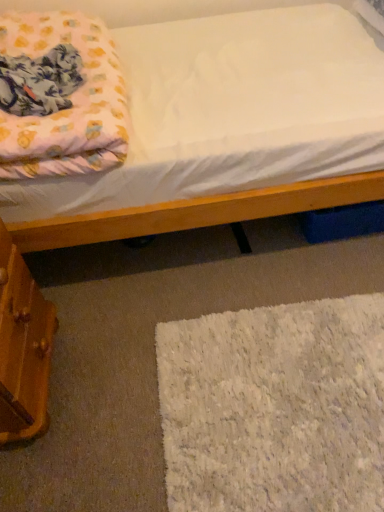
Question: Is wooden drawer at lower left not near fluffy pink blanket at upper left?

Choices:
 (A) yes
 (B) no

Answer: (B)

Question: Is wooden drawer at lower left placed right next to fluffy pink blanket at upper left?

Choices:
 (A) no
 (B) yes

Answer: (A)

Question: Considering the relative sizes of wooden drawer at lower left and fluffy pink blanket at upper left in the image provided, is wooden drawer at lower left thinner than fluffy pink blanket at upper left?

Choices:
 (A) yes
 (B) no

Answer: (A)

Question: Is wooden drawer at lower left shorter than fluffy pink blanket at upper left?

Choices:
 (A) no
 (B) yes

Answer: (A)

Question: From a real-world perspective, is wooden drawer at lower left positioned over fluffy pink blanket at upper left based on gravity?

Choices:
 (A) no
 (B) yes

Answer: (A)

Question: Does wooden drawer at lower left appear on the right side of fluffy pink blanket at upper left?

Choices:
 (A) no
 (B) yes

Answer: (A)

Question: Can you confirm if wooden drawer at lower left is shorter than white fluffy rug at lower right?

Choices:
 (A) yes
 (B) no

Answer: (B)

Question: Is wooden drawer at lower left located outside white fluffy rug at lower right?

Choices:
 (A) no
 (B) yes

Answer: (B)

Question: Can you confirm if wooden drawer at lower left is positioned to the right of white fluffy rug at lower right?

Choices:
 (A) no
 (B) yes

Answer: (A)

Question: Does wooden drawer at lower left have a larger size compared to white fluffy rug at lower right?

Choices:
 (A) yes
 (B) no

Answer: (A)

Question: Does wooden drawer at lower left come behind white fluffy rug at lower right?

Choices:
 (A) yes
 (B) no

Answer: (B)

Question: Is wooden drawer at lower left positioned with its back to white fluffy rug at lower right?

Choices:
 (A) yes
 (B) no

Answer: (B)

Question: Does white fluffy rug at lower right have a lesser height compared to fluffy pink blanket at upper left?

Choices:
 (A) yes
 (B) no

Answer: (A)